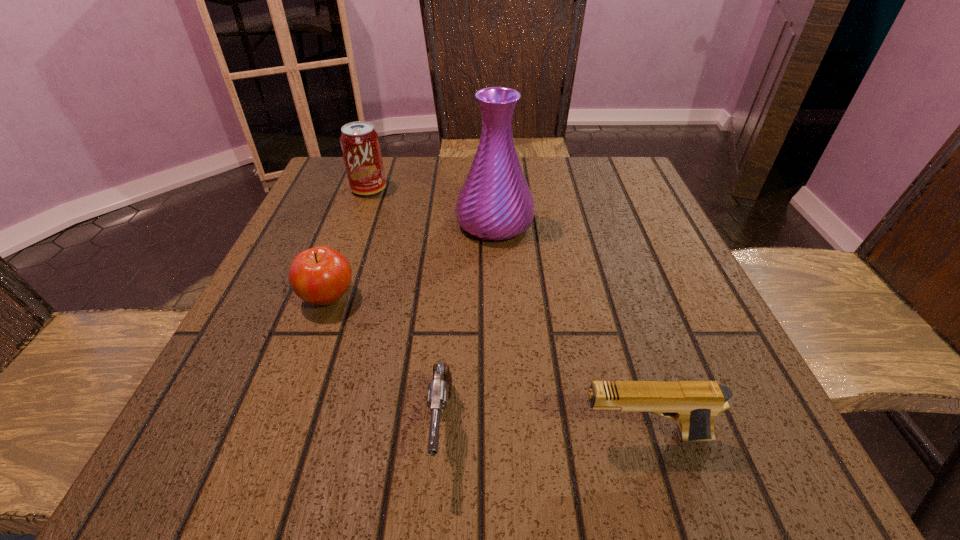
At what (x,y) coordinates should I click in order to perform the action: click on vase. Please return your answer as a coordinate pair (x, y). The width and height of the screenshot is (960, 540). Looking at the image, I should click on (495, 203).

Where is `the second farthest object`? the second farthest object is located at coordinates (495, 203).

Locate an element on the screen. This screenshot has height=540, width=960. the fourth shortest object is located at coordinates (360, 144).

Where is `the farthest object`? the farthest object is located at coordinates (360, 144).

Identify the location of the right pistol. (693, 404).

Where is `the third nearest object`? The height and width of the screenshot is (540, 960). the third nearest object is located at coordinates (321, 275).

Find the location of a particular element. the left pistol is located at coordinates (439, 390).

Where is `free space located on the front of the vase`? free space located on the front of the vase is located at coordinates (501, 382).

Where is `vacant space located on the front of the second tallest object`? vacant space located on the front of the second tallest object is located at coordinates (360, 213).

Image resolution: width=960 pixels, height=540 pixels. I want to click on vacant space located 0.400m at the barrel of the right pistol, so click(276, 436).